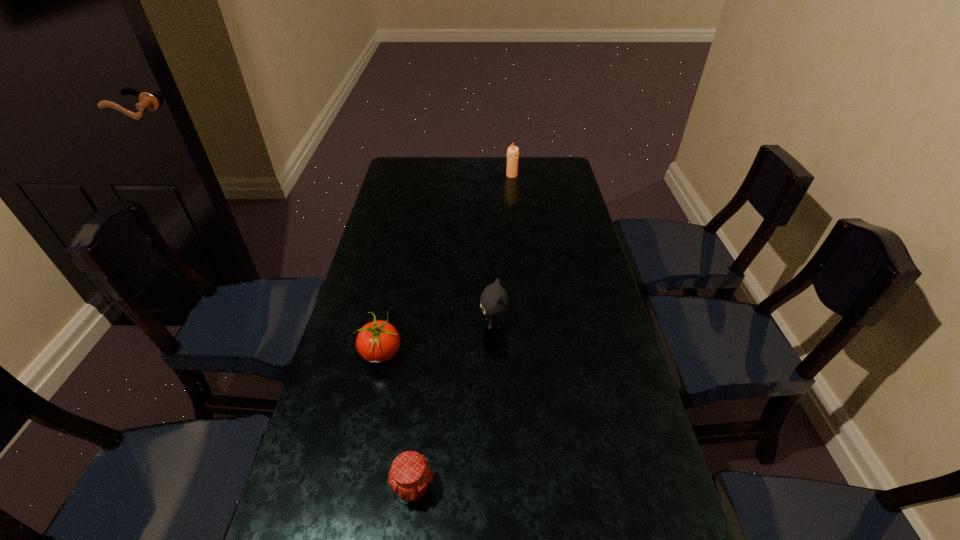
Locate which object ranks second in proximity to the rightmost object. Please provide its 2D coordinates. Your answer should be formatted as a tuple, i.e. [(x, y)], where the tuple contains the x and y coordinates of a point satisfying the conditions above.

[(378, 341)]

I want to click on free space in the image that satisfies the following two spatial constraints: 1. on the front side of the nearest object; 2. on the right side of the leftmost object, so click(353, 488).